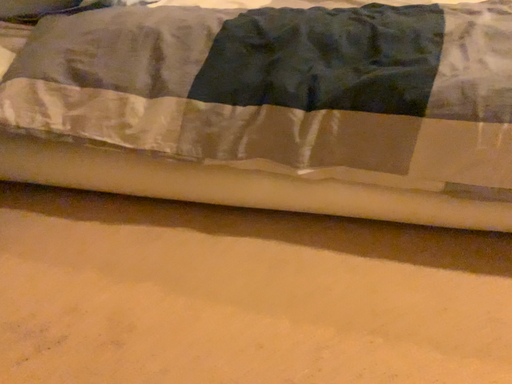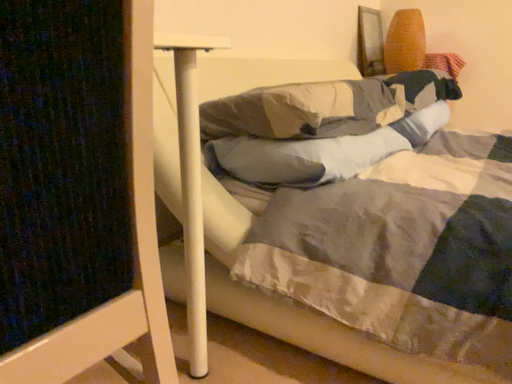
Question: Which way did the camera rotate in the video?

Choices:
 (A) rotated left
 (B) rotated right

Answer: (A)